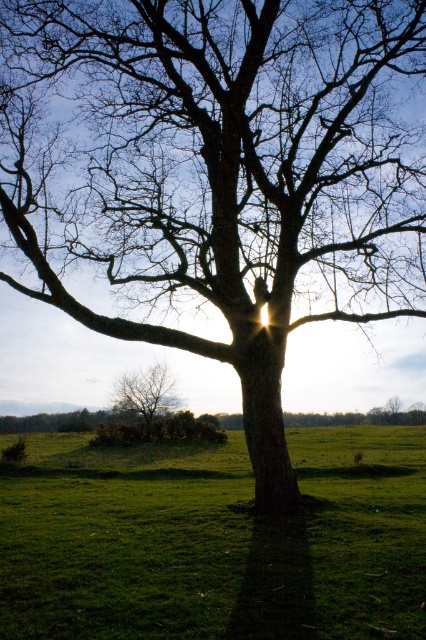
You are standing in the grassy field and want to take a photo of the tree. To ensure the green grass at center is perfectly centered in your photo, where should you position the camera relative to the tree?

To center the green grass at center in the photo, position the camera directly above the grass at point (215, 541), which is at the center of the scene.

You are standing in the grassy field and want to take a photo of the smooth bark tree at lower left. To avoid having the green grass at center in the foreground, which direction should you move relative to the tree?

You should move to the left side of the smooth bark tree at lower left. Since the green grass at center is on the right side of the tree, moving left would position you away from the grass, reducing its presence in the foreground of your photo.

From the picture: You are a gardener planning to plant a new flower bed between the green grass at center and the smooth bark tree at lower left. Since the flower bed requires a space of 1.2 meters, can you determine if there is enough space between them based on their sizes?

The green grass at center is larger in size than the smooth bark tree at lower left. However, the exact distance between them isn not specified in the provided information. Therefore, it is not possible to determine if the 1.2 meter space requirement for the flower bed is met based solely on their sizes.